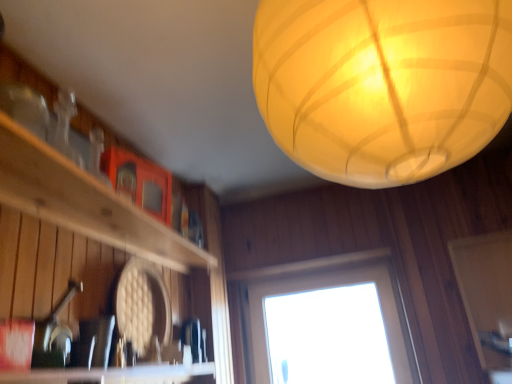
Question: Considering the positions of translucent paper lantern at upper center and white matte screen door at lower right in the image, is translucent paper lantern at upper center wider or thinner than white matte screen door at lower right?

Choices:
 (A) wide
 (B) thin

Answer: (A)

Question: Visually, is translucent paper lantern at upper center positioned to the left or to the right of white matte screen door at lower right?

Choices:
 (A) left
 (B) right

Answer: (A)

Question: Estimate the real-world distances between objects in this image. Which object is closer to the wooden shelf at left?

Choices:
 (A) translucent paper lantern at upper center
 (B) transparent glass window at center
 (C) white matte screen door at lower right

Answer: (A)

Question: Based on their relative distances, which object is nearer to the translucent paper lantern at upper center?

Choices:
 (A) white matte screen door at lower right
 (B) wooden shelf at left
 (C) transparent glass window at center

Answer: (B)